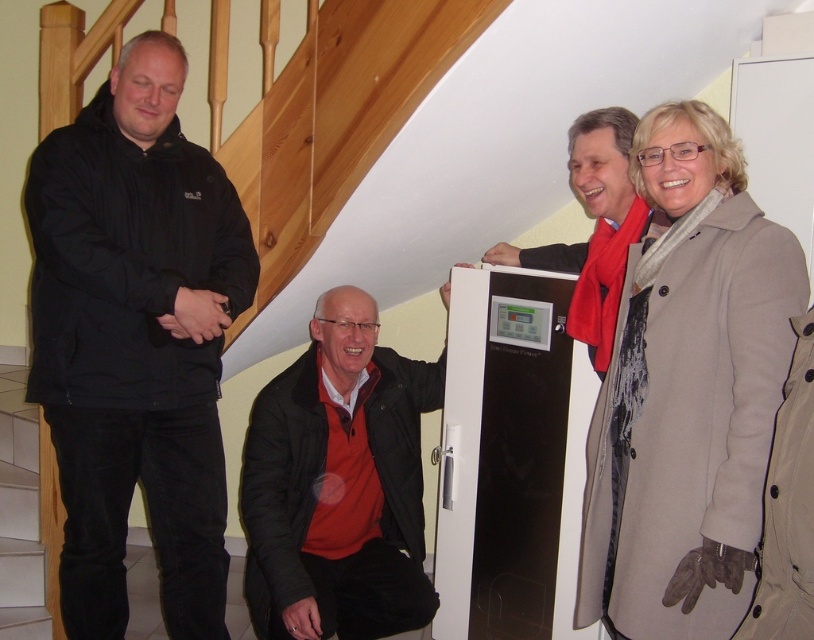
Between black matte jacket at left and beige wool coat at upper right, which one has less height?

beige wool coat at upper right

Can you confirm if black matte jacket at left is wider than beige wool coat at upper right?

Indeed, black matte jacket at left has a greater width compared to beige wool coat at upper right.

Does point (217, 362) lie in front of point (615, 333)?

No, it is behind (615, 333).

At what (x,y) coordinates should I click in order to perform the action: click on black matte jacket at left. Please return your answer as a coordinate pair (x, y). This screenshot has width=814, height=640. Looking at the image, I should click on (134, 340).

From the picture: How distant is beige wool coat at upper right from matte black jacket at upper right?

beige wool coat at upper right is 37.19 centimeters from matte black jacket at upper right.

Between point (769, 355) and point (497, 259), which one is positioned in front?

Point (769, 355) is in front.

Identify the location of beige wool coat at upper right. (686, 392).

Locate an element on the screen. Image resolution: width=814 pixels, height=640 pixels. beige wool coat at upper right is located at coordinates (686, 392).

Is beige wool coat at upper right to the right of black matte jacket at center from the viewer's perspective?

Yes, beige wool coat at upper right is to the right of black matte jacket at center.

Between point (664, 608) and point (255, 520), which one is positioned in front?

Positioned in front is point (664, 608).

At what (x,y) coordinates should I click in order to perform the action: click on beige wool coat at upper right. Please return your answer as a coordinate pair (x, y). This screenshot has height=640, width=814. Looking at the image, I should click on (686, 392).